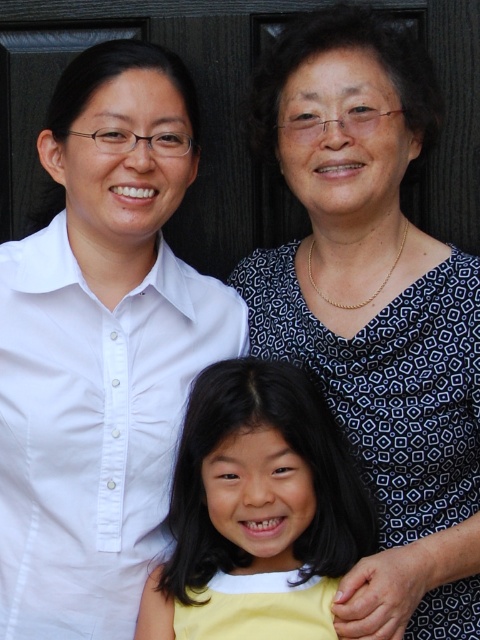
Where is the matte black blouse at upper right located in the image?

The matte black blouse at upper right is located at point (100, 348).

Consider the image. You are a photographer setting up a photo shoot. You have two blouses to place on mannequins for a display. The matte black blouse at upper right and the patterned fabric blouse at center. If you want to arrange them side by side, which blouse should you place on the wider mannequin?

The matte black blouse at upper right should be placed on the wider mannequin because its width is larger than the patterned fabric blouse at center.

You are standing in front of the family photo and want to place a sticker on the exact midpoint between point A at point (331, 355) and point B at point (196, 560). Will the sticker be closer to the adult in the middle or the child on the right?

The sticker will be closer to the child on the right because point A at point (331, 355) is behind point B at point (196, 560), meaning the midpoint between them is closer to point B, which is the child on the right.